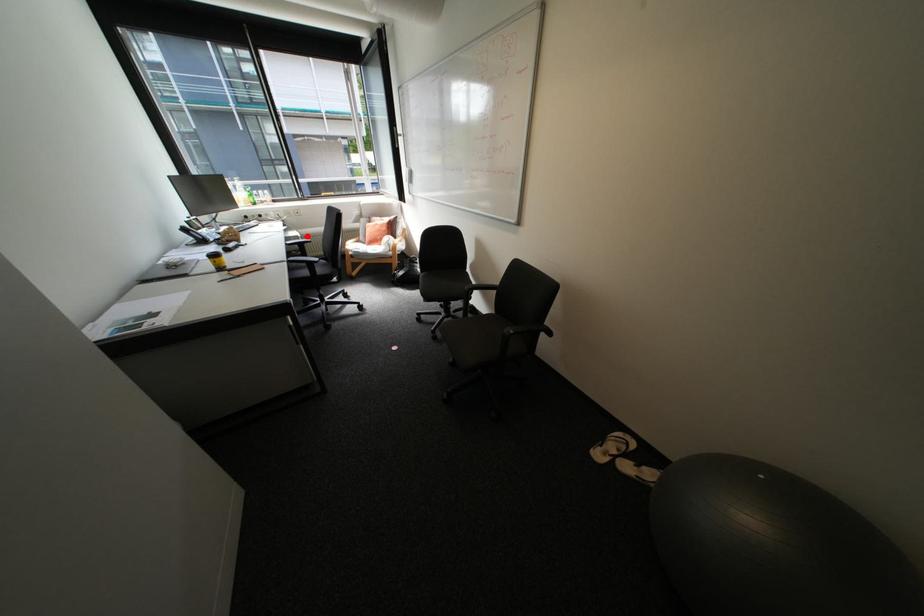
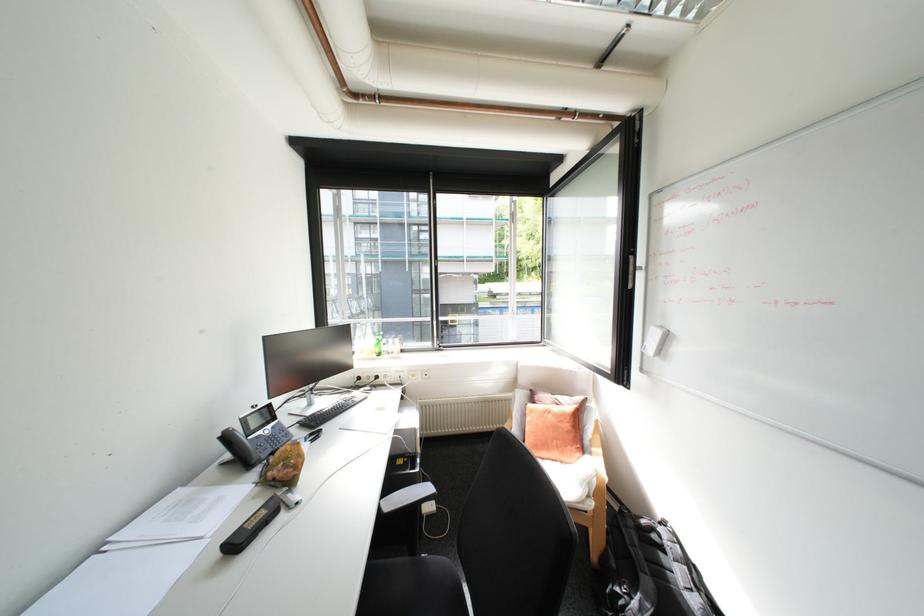
Question: A red point is marked in image1. In image2, is the corresponding 3D point closer to the camera or farther? Reply with the corresponding letter.

Choices:
 (A) The corresponding 3D point is closer.
 (B) The corresponding 3D point is farther.

Answer: (A)